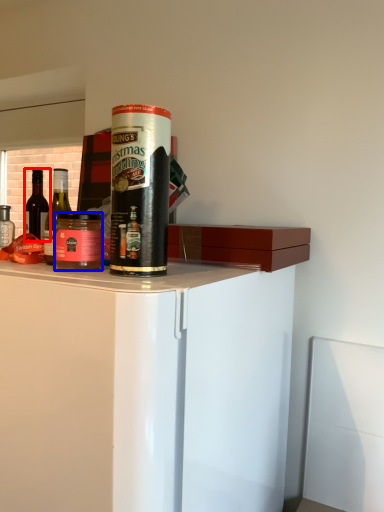
Question: Which point is closer to the camera, bottle (highlighted by a red box) or beverage (highlighted by a blue box)?

Choices:
 (A) bottle
 (B) beverage

Answer: (B)